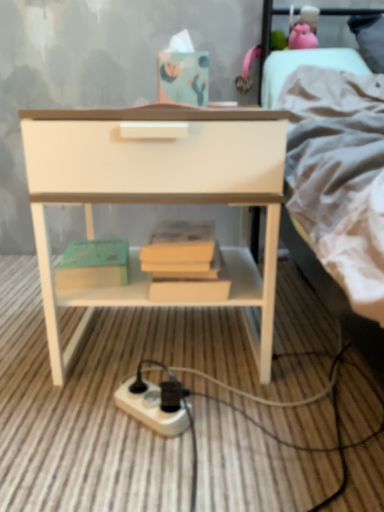
Question: Does point click(x=140, y=395) appear closer or farther from the camera than point click(x=349, y=159)?

Choices:
 (A) closer
 (B) farther

Answer: (B)

Question: In the image, is white plastic power plugs and sockets at lower center on the left side or the right side of light gray fabric bed at upper right?

Choices:
 (A) right
 (B) left

Answer: (B)

Question: Which of these objects is positioned closest to the white glossy nightstand at center?

Choices:
 (A) green matte paperback book at lower left
 (B) white plastic power plugs and sockets at lower center
 (C) light gray fabric bed at upper right

Answer: (A)

Question: Which of these objects is positioned closest to the white glossy nightstand at center?

Choices:
 (A) light gray fabric bed at upper right
 (B) white plastic power plugs and sockets at lower center
 (C) green matte paperback book at lower left

Answer: (C)